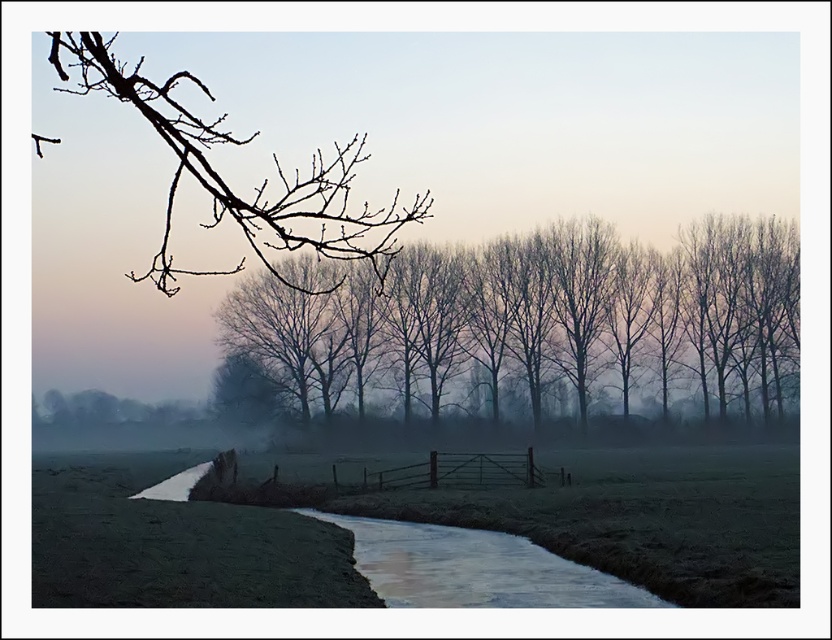
How much distance is there between silvery branches at center and bare branches at upper left?

A distance of 19.35 meters exists between silvery branches at center and bare branches at upper left.

Who is taller, silvery branches at center or bare branches at upper left?

bare branches at upper left

Is point (494, 387) in front of point (172, 147)?

That is False.

Locate an element on the screen. This screenshot has height=640, width=832. silvery branches at center is located at coordinates (531, 324).

Who is positioned more to the left, silvery branches at center or metallic gate at center?

metallic gate at center is more to the left.

What do you see at coordinates (531, 324) in the screenshot? The height and width of the screenshot is (640, 832). I see `silvery branches at center` at bounding box center [531, 324].

The height and width of the screenshot is (640, 832). What are the coordinates of `silvery branches at center` in the screenshot? It's located at (531, 324).

The width and height of the screenshot is (832, 640). I want to click on silvery branches at center, so click(531, 324).

Does point (102, 56) come behind point (350, 474)?

No, (102, 56) is closer to viewer.

Describe the element at coordinates (226, 182) in the screenshot. I see `bare branches at upper left` at that location.

Identify the location of bare branches at upper left. The width and height of the screenshot is (832, 640). (226, 182).

I want to click on bare branches at upper left, so click(x=226, y=182).